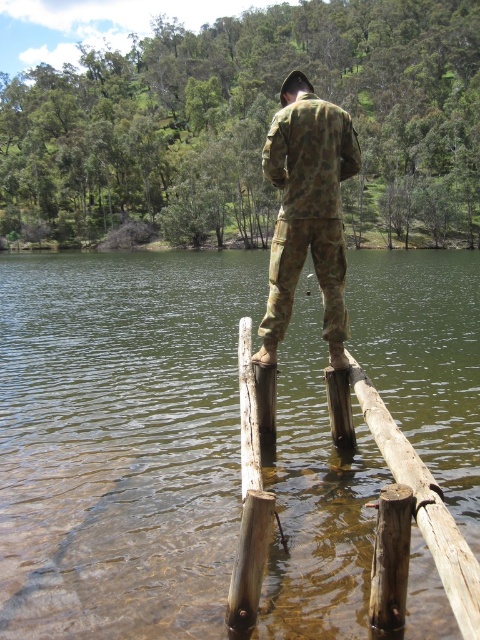
Between camouflage fabric pants at center and brown wooden rail at center, which one has more height?

With more height is camouflage fabric pants at center.

Describe the element at coordinates (308, 211) in the screenshot. I see `camouflage fabric pants at center` at that location.

Image resolution: width=480 pixels, height=640 pixels. In order to click on camouflage fabric pants at center in this screenshot , I will do `click(308, 211)`.

Between camouflage fabric pants at center and brown wood pole at center, which one is positioned higher?

Positioned higher is camouflage fabric pants at center.

Is camouflage fabric pants at center behind brown wood pole at center?

Yes, camouflage fabric pants at center is further from the viewer.

Measure the distance between camouflage fabric pants at center and camera.

camouflage fabric pants at center and camera are 7.41 meters apart from each other.

Find the location of a particular element. This screenshot has height=640, width=480. camouflage fabric pants at center is located at coordinates (308, 211).

Between clear water at post center and brown wood pole at center, which one has more height?

Standing taller between the two is clear water at post center.

Who is shorter, clear water at post center or brown wood pole at center?

brown wood pole at center

Between point (167, 570) and point (244, 506), which one is positioned behind?

The point (167, 570) is more distant.

Identify the location of clear water at post center. (120, 440).